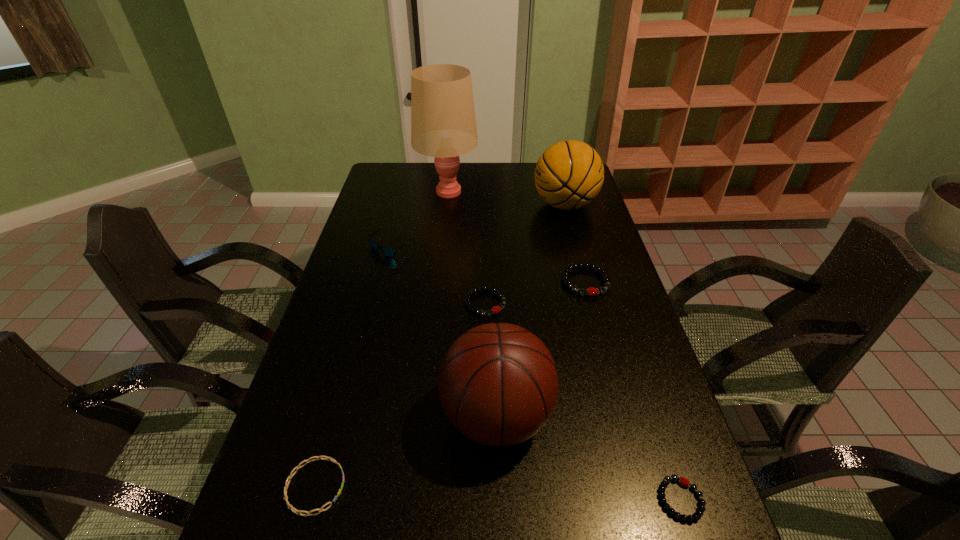
Where is `the tallest object`? the tallest object is located at coordinates (443, 125).

This screenshot has height=540, width=960. In order to click on pink lampshade in this screenshot , I will do `click(443, 125)`.

Where is `the right basketball`? the right basketball is located at coordinates (569, 174).

Locate an element on the screen. This screenshot has height=540, width=960. the farther basketball is located at coordinates (569, 174).

Where is `brown basketball`? Image resolution: width=960 pixels, height=540 pixels. brown basketball is located at coordinates (498, 384).

Where is `the nearer basketball`? This screenshot has width=960, height=540. the nearer basketball is located at coordinates (498, 384).

You are a GUI agent. You are given a task and a screenshot of the screen. Output one action in this format:
    pyautogui.click(x=<x>, y=<y>)
    Task: Click on the third farthest object
    Image resolution: width=960 pixels, height=540 pixels.
    Given the screenshot: What is the action you would take?
    pyautogui.click(x=387, y=251)

Identify the location of sunglasses. The image size is (960, 540). (387, 251).

Image resolution: width=960 pixels, height=540 pixels. What are the coordinates of `the fourth shortest object` in the screenshot? It's located at (591, 291).

You are a GUI agent. You are given a task and a screenshot of the screen. Output one action in this format:
    pyautogui.click(x=<x>, y=<y>)
    Task: Click on the tallest bracelet
    Image resolution: width=960 pixels, height=540 pixels.
    Given the screenshot: What is the action you would take?
    pyautogui.click(x=591, y=291)